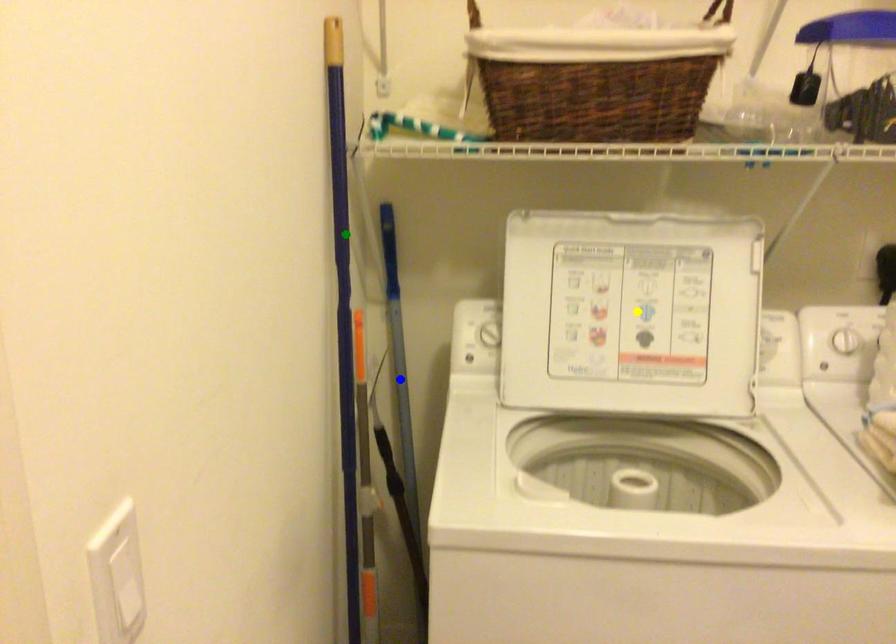
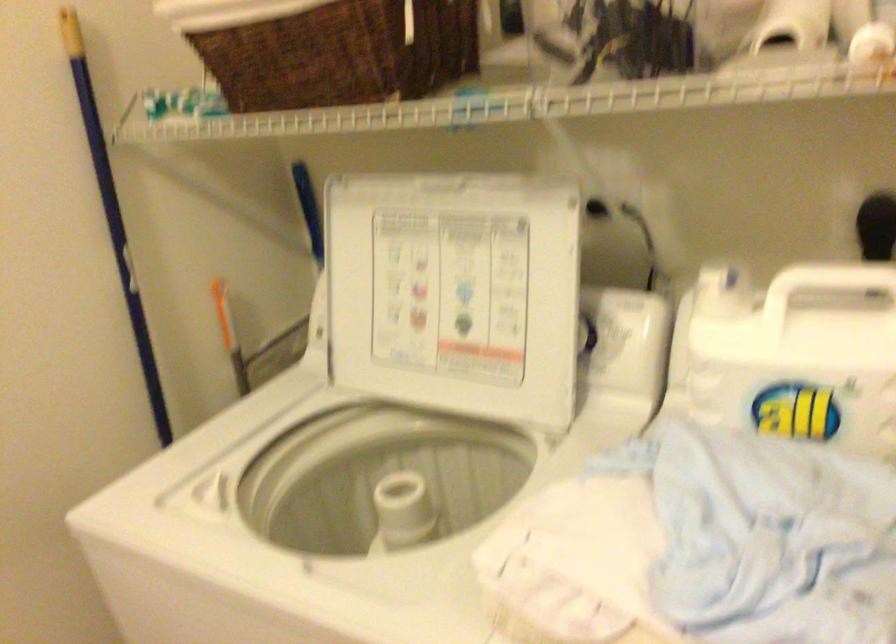
I am providing you with two images of the same scene from different viewpoints. Three points are marked in image1. Which point corresponds to a part or object that is occluded in image2?In image1, three points are marked. Which of them correspond to a part or object that is occluded in image2?Among the three points shown in image1, which one corresponds to a part or object that is no longer visible due to occlusion in image2?

Invisible in image2: blue point.